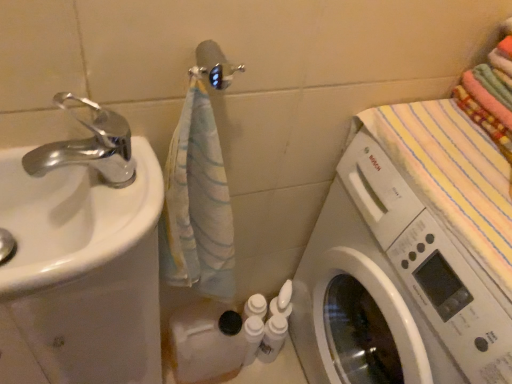
Question: Is white glossy bottles at lower center, which appears as the first toiletry when viewed from the right, at the back of white plastic washing machine at right?

Choices:
 (A) no
 (B) yes

Answer: (A)

Question: Can you confirm if white plastic washing machine at right is thinner than white glossy bottles at lower center, the 2th toiletry when ordered from left to right?

Choices:
 (A) yes
 (B) no

Answer: (B)

Question: From a real-world perspective, is white plastic washing machine at right located beneath white glossy bottles at lower center, the 2th toiletry when ordered from left to right?

Choices:
 (A) yes
 (B) no

Answer: (B)

Question: Does white plastic washing machine at right turn towards white glossy bottles at lower center, the 2th toiletry when ordered from left to right?

Choices:
 (A) no
 (B) yes

Answer: (B)

Question: Is white glossy bottles at lower center, the 2th toiletry when ordered from left to right, a part of white plastic washing machine at right?

Choices:
 (A) no
 (B) yes

Answer: (A)

Question: From a real-world perspective, does white plastic washing machine at right stand above white glossy bottles at lower center, the 2th toiletry when ordered from left to right?

Choices:
 (A) no
 (B) yes

Answer: (B)

Question: Considering the relative sizes of white glossy sink at left and white plastic bottles at center, the 1th toiletry viewed from the left, in the image provided, is white glossy sink at left thinner than white plastic bottles at center, the 1th toiletry viewed from the left,?

Choices:
 (A) yes
 (B) no

Answer: (B)

Question: Considering the relative sizes of white glossy sink at left and white plastic bottles at center, the 1th toiletry viewed from the left, in the image provided, is white glossy sink at left taller than white plastic bottles at center, the 1th toiletry viewed from the left,?

Choices:
 (A) no
 (B) yes

Answer: (A)

Question: Does white glossy sink at left lie in front of white plastic bottles at center, the 1th toiletry viewed from the left?

Choices:
 (A) no
 (B) yes

Answer: (B)

Question: From the image's perspective, is white glossy sink at left below white plastic bottles at center, which is the second toiletry from right to left?

Choices:
 (A) no
 (B) yes

Answer: (A)

Question: Is white glossy sink at left with white plastic bottles at center, which is the second toiletry from right to left?

Choices:
 (A) no
 (B) yes

Answer: (A)

Question: From a real-world perspective, is white glossy sink at left below white plastic bottles at center, which is the second toiletry from right to left?

Choices:
 (A) no
 (B) yes

Answer: (A)

Question: Is chrome metallic faucet at left outside of white plastic washing machine at right?

Choices:
 (A) no
 (B) yes

Answer: (B)